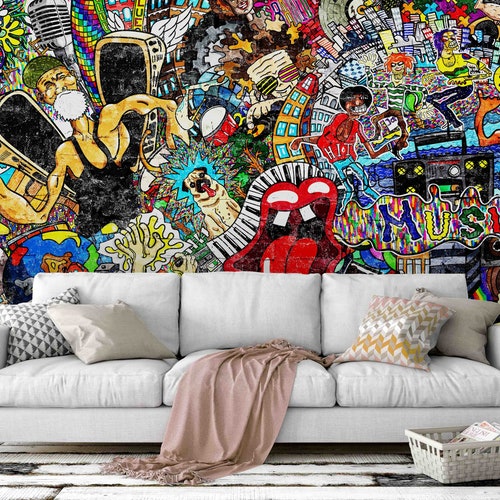
Where is `sides of couch`? This screenshot has height=500, width=500. sides of couch is located at coordinates (493, 340), (7, 335).